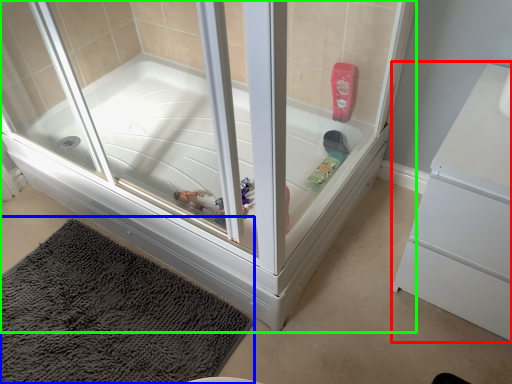
Question: Which object is the closest to the dresser (highlighted by a red box)? Choose among these: bath mat (highlighted by a blue box) or bathtub (highlighted by a green box).

Choices:
 (A) bath mat
 (B) bathtub

Answer: (B)